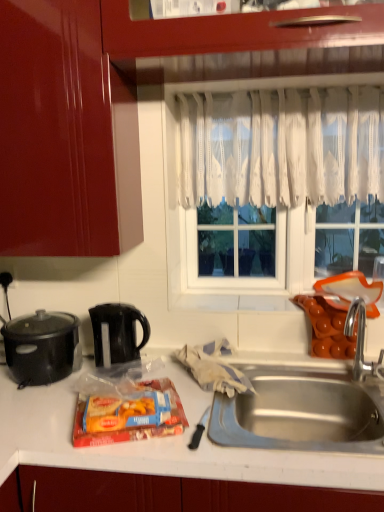
This screenshot has height=512, width=384. Identify the location of empty space that is ontop of white lace curtain at upper center (from a real-world perspective). (277, 89).